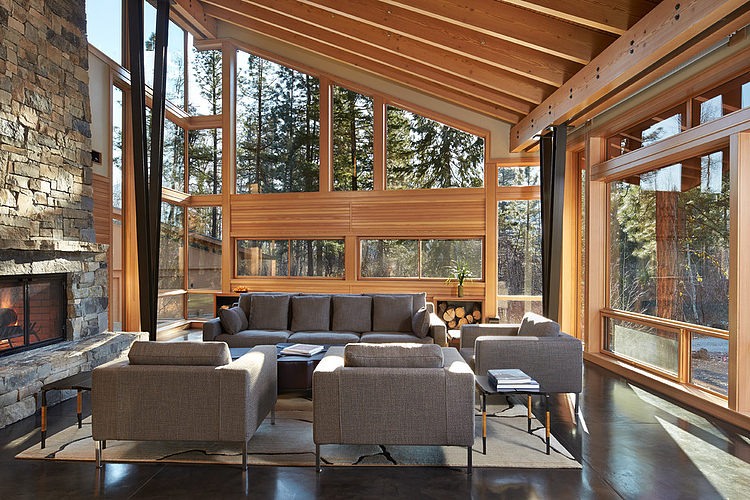
Where is `fireplace`? fireplace is located at coordinates (76, 185).